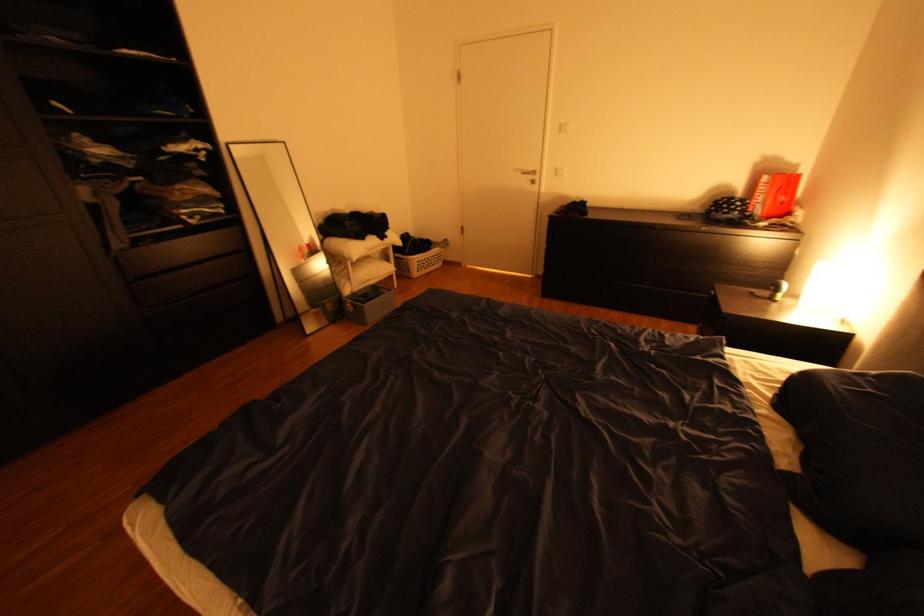
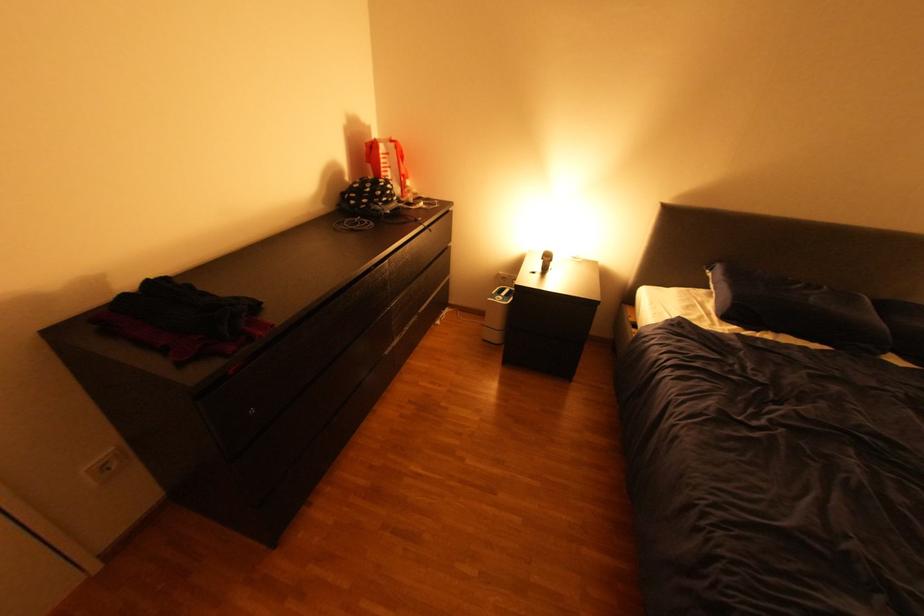
The point at [806,166] is marked in the first image. Where is the corresponding point in the second image?

(379, 129)